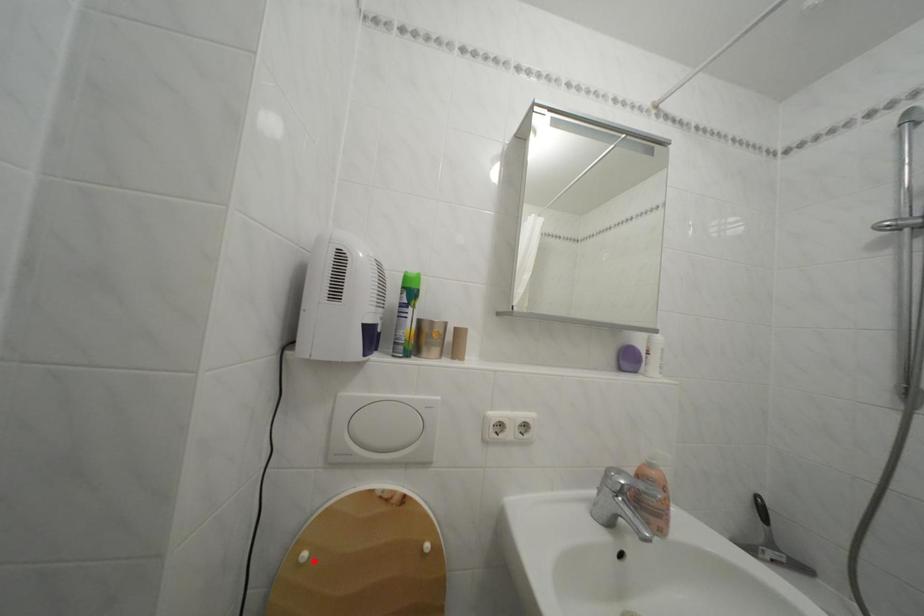
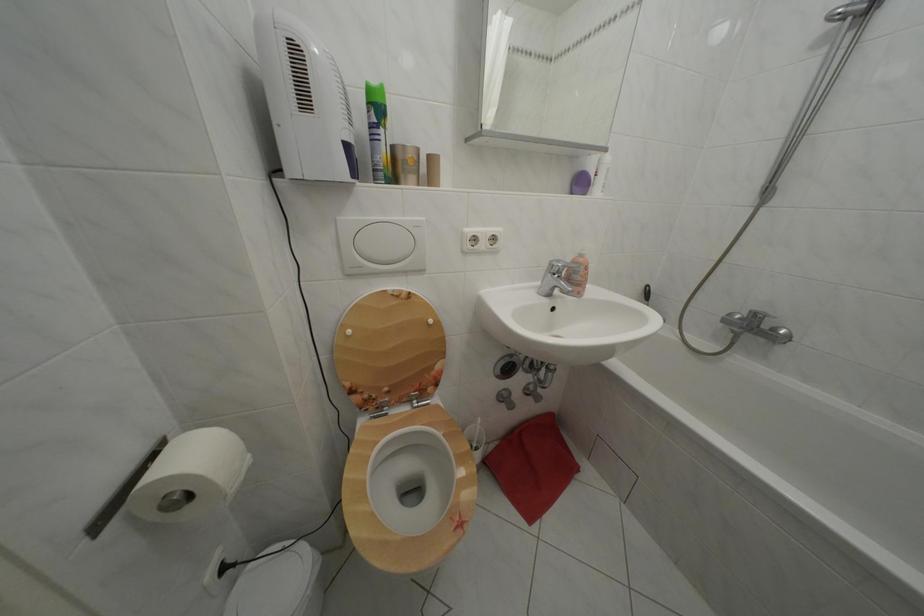
The point at the highlighted location is marked in the first image. Where is the corresponding point in the second image?

(358, 338)